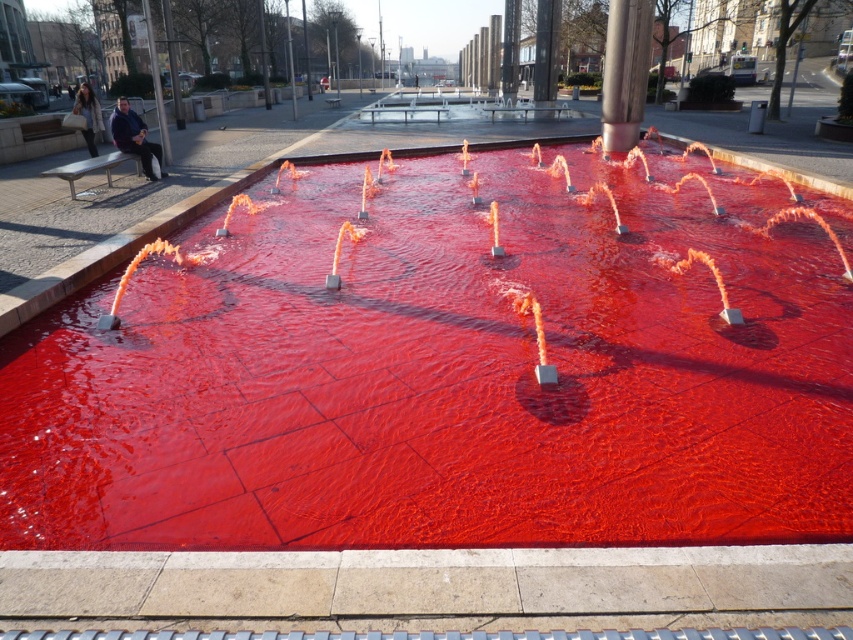
Question: Which object is closer to the camera taking this photo?

Choices:
 (A) polished stainless steel pole at center
 (B) red glossy water at center

Answer: (B)

Question: Where is red glossy water at center located in relation to polished stainless steel pole at center in the image?

Choices:
 (A) below
 (B) above

Answer: (A)

Question: Which point appears closest to the camera in this image?

Choices:
 (A) (637, 129)
 (B) (10, 404)

Answer: (B)

Question: Does red glossy water at center have a smaller size compared to polished stainless steel pole at center?

Choices:
 (A) no
 (B) yes

Answer: (B)

Question: Which of the following is the farthest from the observer?

Choices:
 (A) (608, 65)
 (B) (703, 419)

Answer: (A)

Question: In this image, where is red glossy water at center located relative to polished stainless steel pole at center?

Choices:
 (A) above
 (B) below

Answer: (B)